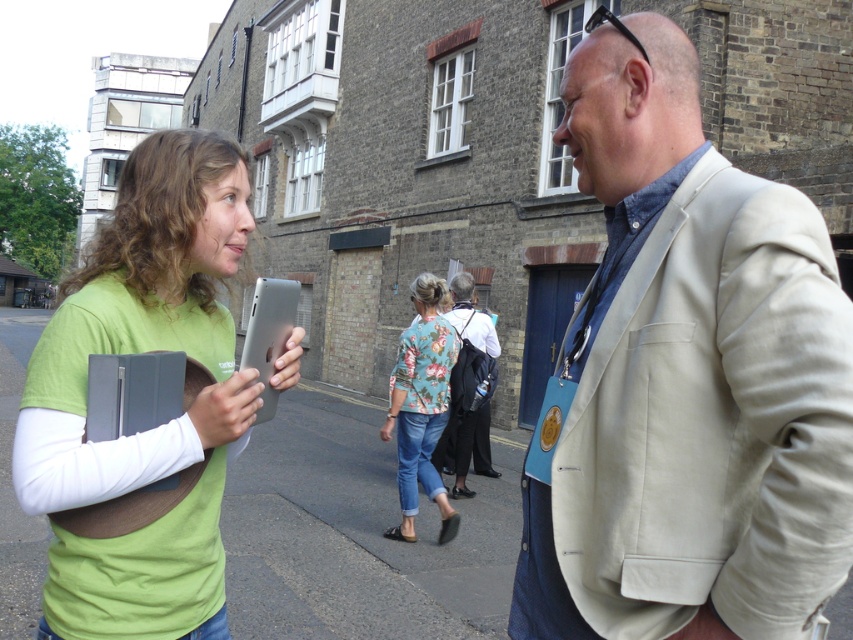
Question: Which object appears farthest from the camera in this image?

Choices:
 (A) green matte shirt at left
 (B) black leather jacket at center
 (C) floral fabric blouse at center
 (D) gray asphalt at center

Answer: (B)

Question: Which of the following is the farthest from the observer?

Choices:
 (A) black leather jacket at center
 (B) gray asphalt at center
 (C) green matte shirt at left

Answer: (A)

Question: Does beige fabric jacket at center come behind green matte shirt at left?

Choices:
 (A) yes
 (B) no

Answer: (B)

Question: Is beige fabric jacket at center smaller than gray asphalt at center?

Choices:
 (A) yes
 (B) no

Answer: (A)

Question: Which object is the farthest from the gray asphalt at center?

Choices:
 (A) black leather jacket at center
 (B) beige fabric jacket at center
 (C) floral fabric blouse at center

Answer: (A)

Question: Can you confirm if beige fabric jacket at center is wider than black leather jacket at center?

Choices:
 (A) no
 (B) yes

Answer: (A)